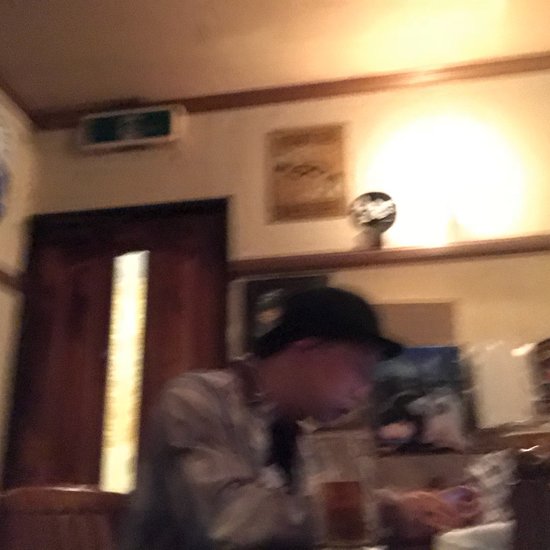
What are the coordinates of `pictures` in the screenshot? It's located at (469, 426), (423, 322), (272, 308), (302, 185).